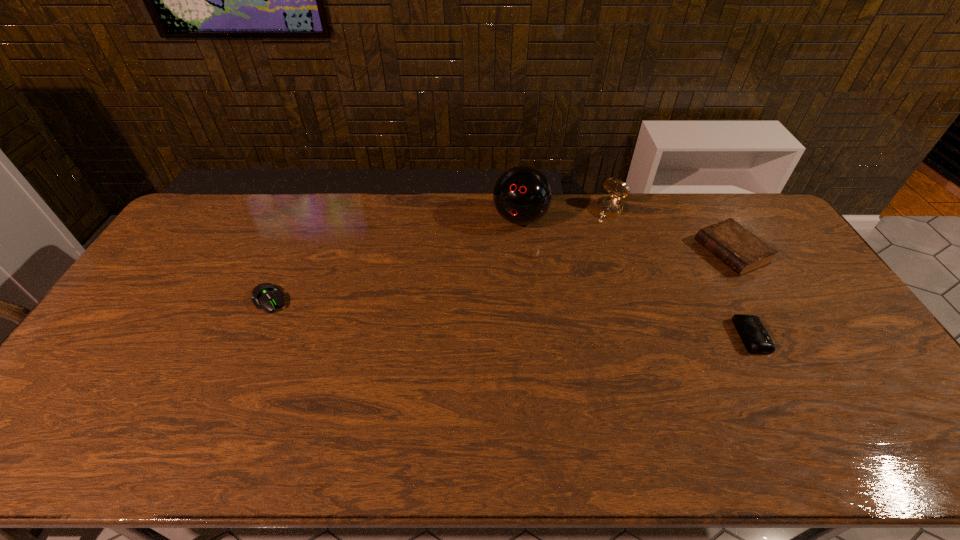
I want to click on vacant point located on the surface of the tallest object near the finger holes, so click(x=478, y=309).

Locate an element on the screen. The width and height of the screenshot is (960, 540). free space located on the surface of the tallest object near the finger holes is located at coordinates (481, 302).

The width and height of the screenshot is (960, 540). Identify the location of free location located on the surface of the tallest object near the finger holes. (481, 302).

Where is `vacant space positioned 0.050m with the dial facing the compass`? The image size is (960, 540). vacant space positioned 0.050m with the dial facing the compass is located at coordinates click(597, 225).

At what (x,y) coordinates should I click in order to perform the action: click on vacant space located with the dial facing the compass. Please return your answer as a coordinate pair (x, y). The width and height of the screenshot is (960, 540). Looking at the image, I should click on click(564, 262).

You are a GUI agent. You are given a task and a screenshot of the screen. Output one action in this format:
    pyautogui.click(x=<x>, y=<y>)
    Task: Click on the vacant position located with the dial facing the compass
    
    Given the screenshot: What is the action you would take?
    pyautogui.click(x=545, y=281)

Locate an element on the screen. vacant space situated on the spine side of the diary is located at coordinates (622, 296).

Locate an element on the screen. This screenshot has width=960, height=540. free spot located on the spine side of the diary is located at coordinates (612, 301).

The image size is (960, 540). Find the location of `free space located 0.390m on the spine side of the diary`. free space located 0.390m on the spine side of the diary is located at coordinates (609, 302).

Identify the location of bowling ball at the far edge. (522, 195).